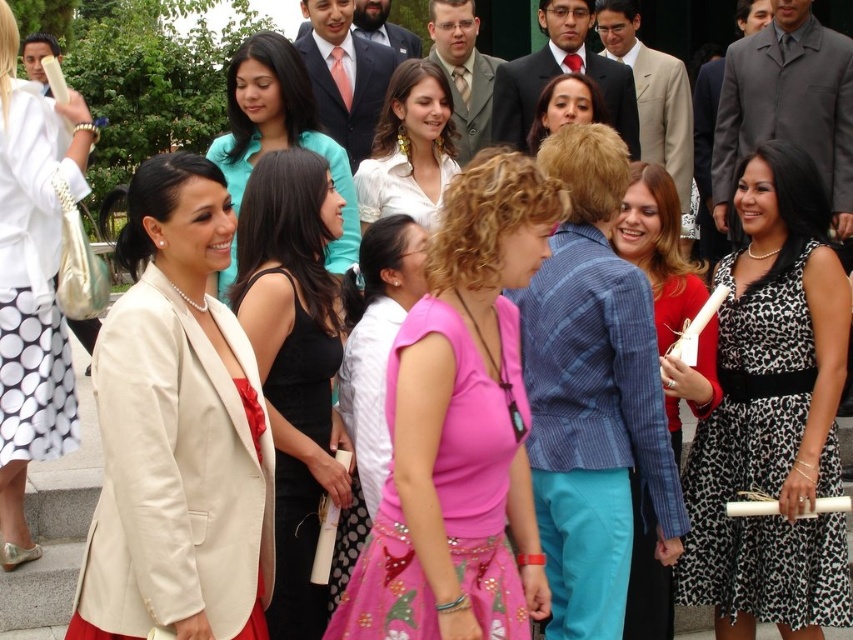
You are a photographer at a formal event and need to capture a wide shot that includes both the black leopard print dress at right and the black satin dress at center. Given their sizes, which dress will require more space in the frame to avoid being cropped?

The black leopard print dress at right requires more space in the frame because its width surpasses that of the black satin dress at center, so it needs adequate room to be fully captured without cropping.

You are standing at the center of the garden and see two points in the image. Which point is closer to you, point (805, 579) or point (289, 477)?

Point (805, 579) is in front of point (289, 477), so it is closer to you.